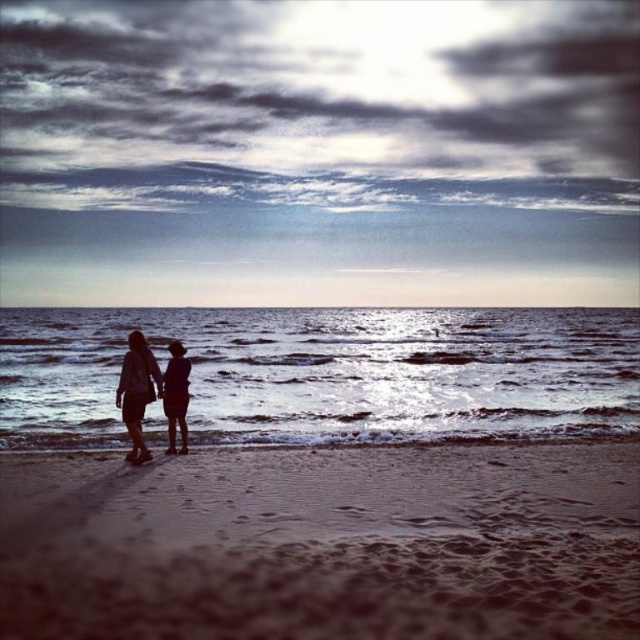
Question: Among these points, which one is nearest to the camera?

Choices:
 (A) (93, 632)
 (B) (134, 332)

Answer: (A)

Question: Which object is positioned farthest from the brown sandy beach at lower center?

Choices:
 (A) shiny silver water at center
 (B) silhouette fabric couple at center

Answer: (A)

Question: Observing the image, what is the correct spatial positioning of brown sandy beach at lower center in reference to shiny silver water at center?

Choices:
 (A) above
 (B) below

Answer: (B)

Question: Which point is closer to the camera taking this photo?

Choices:
 (A) (582, 508)
 (B) (294, 352)
 (C) (138, 380)

Answer: (A)

Question: Is the position of shiny silver water at center less distant than that of silhouette fabric couple at center?

Choices:
 (A) no
 (B) yes

Answer: (A)

Question: In this image, where is brown sandy beach at lower center located relative to silhouette fabric couple at center?

Choices:
 (A) above
 (B) below

Answer: (B)